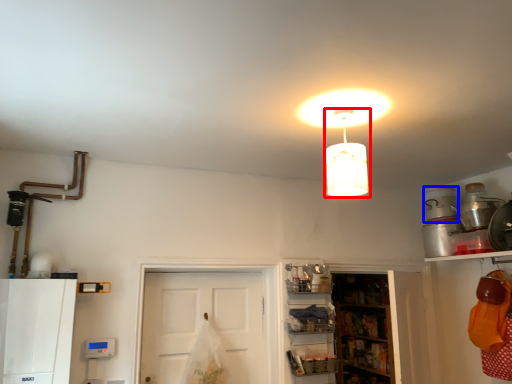
Question: Which point is closer to the camera, lamp (highlighted by a red box) or appliance (highlighted by a blue box)?

Choices:
 (A) lamp
 (B) appliance

Answer: (A)